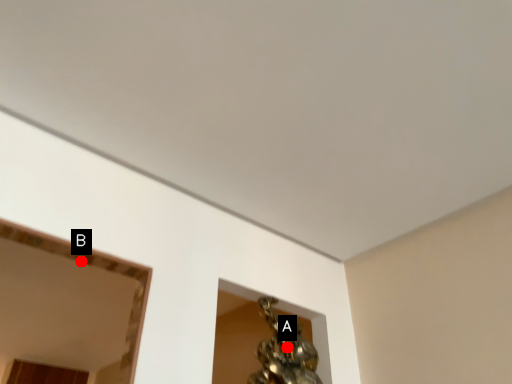
Question: Two points are circled on the image, labeled by A and B beside each circle. Which point is farther to the camera?

Choices:
 (A) A is further
 (B) B is further

Answer: (A)